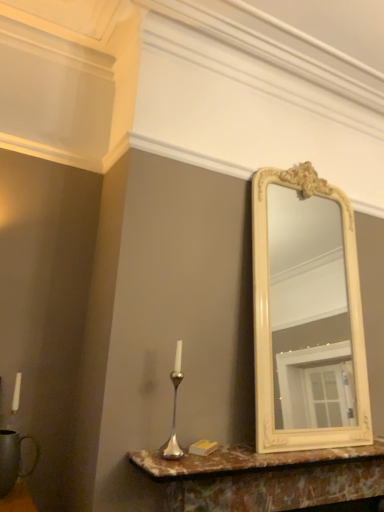
What do you see at coordinates (265, 478) in the screenshot? The width and height of the screenshot is (384, 512). I see `marble/marbled vanity at center` at bounding box center [265, 478].

Where is `marble/marbled vanity at center`? The height and width of the screenshot is (512, 384). marble/marbled vanity at center is located at coordinates (265, 478).

Where is `marble/marbled vanity at center`? marble/marbled vanity at center is located at coordinates (265, 478).